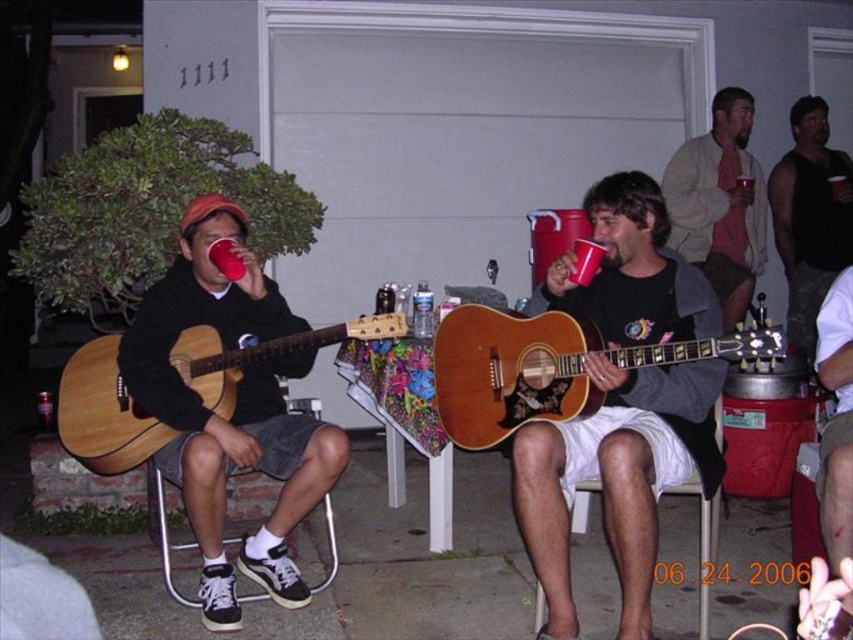
You are a photographer at the backyard party. You want to take a photo of the matte brown guitar at center and the red plastic cup at upper center. Which object should you focus on first to ensure both are in frame?

You should focus on the matte brown guitar at center first because it is positioned under the red plastic cup at upper center, so adjusting the camera to include the lower object ensures the upper one is also captured.

You are organizing a small concert in the backyard and need to place a 1.2 meter wide amplifier between the wooden acoustic guitar at center and the white fabric chair at lower center. Can the amplifier fit between them?

The wooden acoustic guitar at center is wider than the white fabric chair at lower center. Since the amplifier is 1.2 meters wide, but the space between them isn not specified, we cannot determine if it fits.

Looking at this image, you are planning to place a small decorative item that is 10 cm wide on the table between the matte brown guitar at center and the red plastic cup at upper center. Considering their sizes, will there be enough space for the item next to the wider object?

The matte brown guitar at center is wider than the red plastic cup at upper center. Since the decorative item is 10 cm wide, placing it next to the wider matte brown guitar at center would require checking if there is sufficient space between them. However, without knowing the exact distance between the two objects, it is impossible to determine if the 10 cm width will fit.